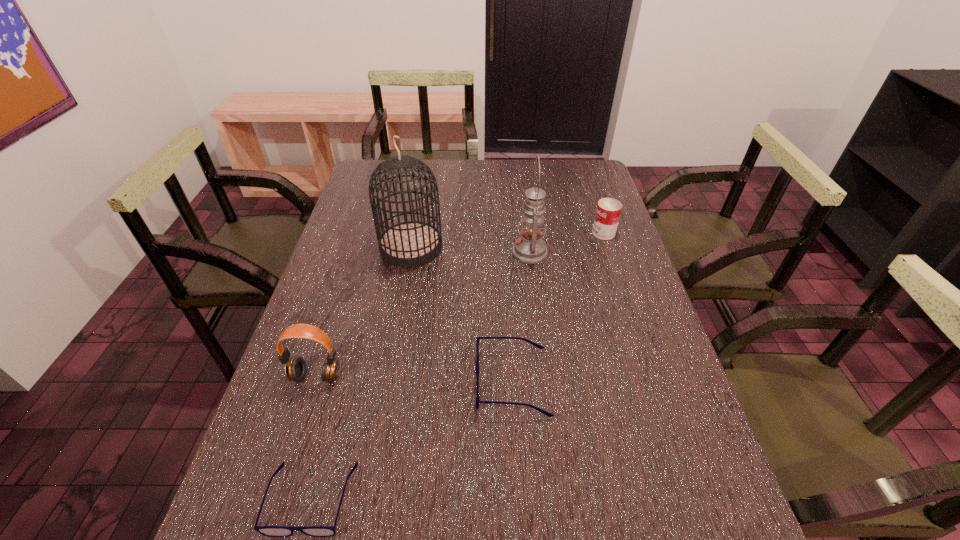
The image size is (960, 540). In order to click on free space located 0.260m on the front-facing side of the taller spectacles in this screenshot , I will do `click(364, 382)`.

The image size is (960, 540). What are the coordinates of `free space located on the front-facing side of the taller spectacles` in the screenshot? It's located at (416, 382).

What are the coordinates of `vacant area located on the left of the oil lamp` in the screenshot? It's located at (495, 252).

At what (x,y) coordinates should I click in order to perform the action: click on free space located 0.300m on the front of the birdcage. Please return your answer as a coordinate pair (x, y). Looking at the image, I should click on point(393,347).

In order to click on vacant region located 0.240m on the ear cups of the headset in this screenshot , I will do point(277,495).

Identify the location of vacant space positioned on the front label of the can. This screenshot has width=960, height=540. (564, 233).

I want to click on vacant area situated on the front label of the can, so [567, 233].

I want to click on blank space located on the front label of the can, so click(x=567, y=233).

I want to click on object that is at the near edge, so click(270, 531).

The height and width of the screenshot is (540, 960). Find the location of `spectacles that is positioned at the left edge`. spectacles that is positioned at the left edge is located at coordinates [270, 531].